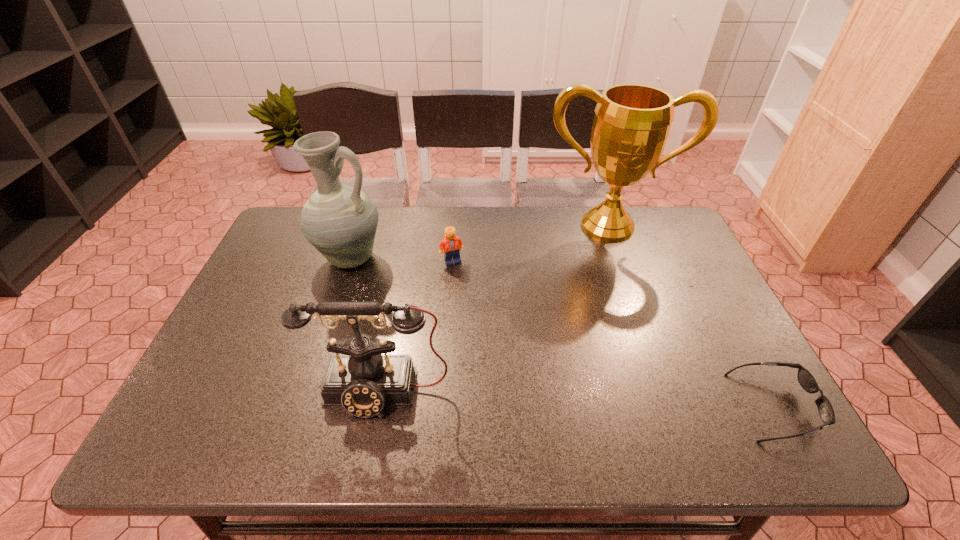
I want to click on vacant spot on the desktop that is between the third tallest object and the sunglasses and is positioned on the front-facing side of the fourth tallest object, so click(611, 401).

This screenshot has width=960, height=540. Identify the location of free spot on the desktop that is between the telephone and the sunglasses and is positioned on the front-facing side of the award. (625, 401).

At what (x,y) coordinates should I click in order to perform the action: click on vacant spot on the desktop that is between the telephone and the sunglasses and is positioned on the handle side of the pitcher. Please return your answer as a coordinate pair (x, y). Looking at the image, I should click on (559, 399).